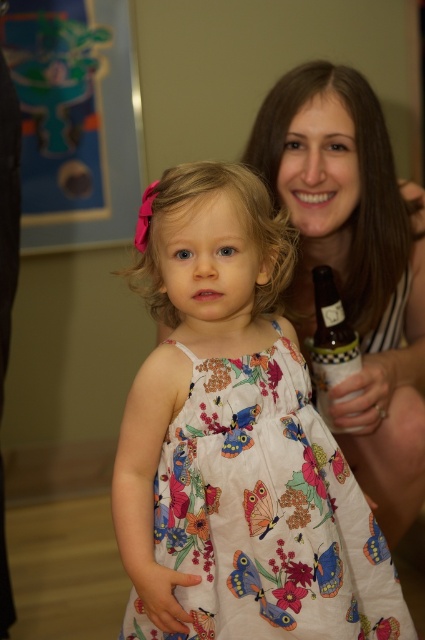
In the scene shown: Who is more forward, (231, 436) or (351, 132)?

Point (231, 436)

Does floral cotton dress at center have a lesser width compared to matte white dress at center?

In fact, floral cotton dress at center might be wider than matte white dress at center.

Is point (232, 412) positioned behind point (336, 193)?

No, it is in front of (336, 193).

The height and width of the screenshot is (640, 425). In order to click on floral cotton dress at center in this screenshot , I will do `click(265, 513)`.

Who is higher up, floral cotton dress at center or translucent glass bottle at right?

translucent glass bottle at right is above.

Identify the location of floral cotton dress at center. This screenshot has height=640, width=425. (265, 513).

Find the location of a particular element. The image size is (425, 640). floral cotton dress at center is located at coordinates (265, 513).

Does matte white dress at center have a greater height compared to translucent glass bottle at right?

Indeed, matte white dress at center has a greater height compared to translucent glass bottle at right.

Who is shorter, matte white dress at center or translucent glass bottle at right?

translucent glass bottle at right is shorter.

Describe the element at coordinates (354, 266) in the screenshot. The image size is (425, 640). I see `matte white dress at center` at that location.

The height and width of the screenshot is (640, 425). In order to click on matte white dress at center in this screenshot , I will do [x=354, y=266].